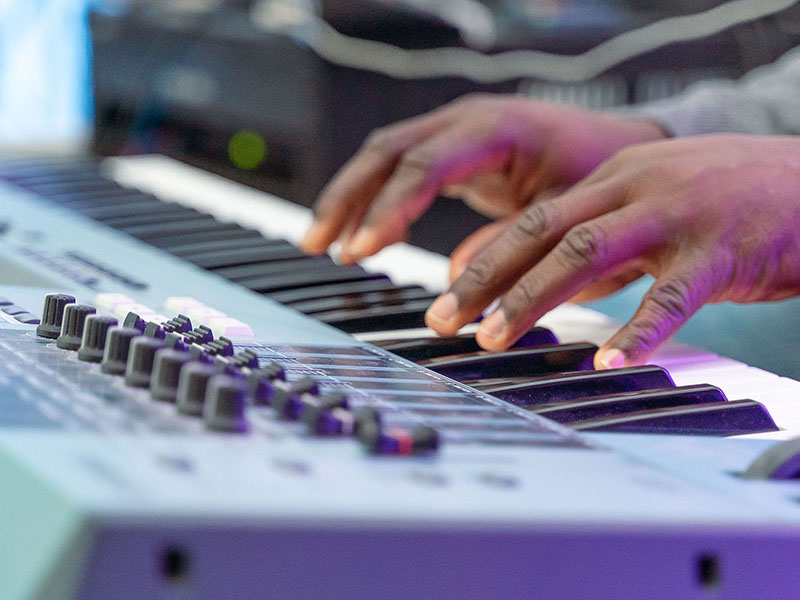
I want to click on black knobs, so click(x=226, y=400), click(x=197, y=382), click(x=158, y=360), click(x=140, y=345), click(x=116, y=339), click(x=86, y=322), click(x=72, y=315), click(x=52, y=304).